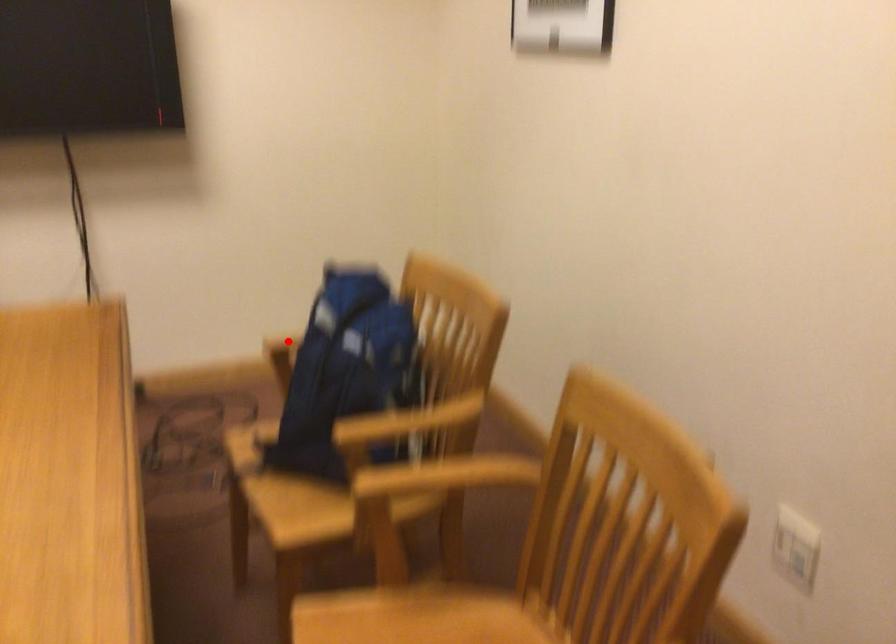
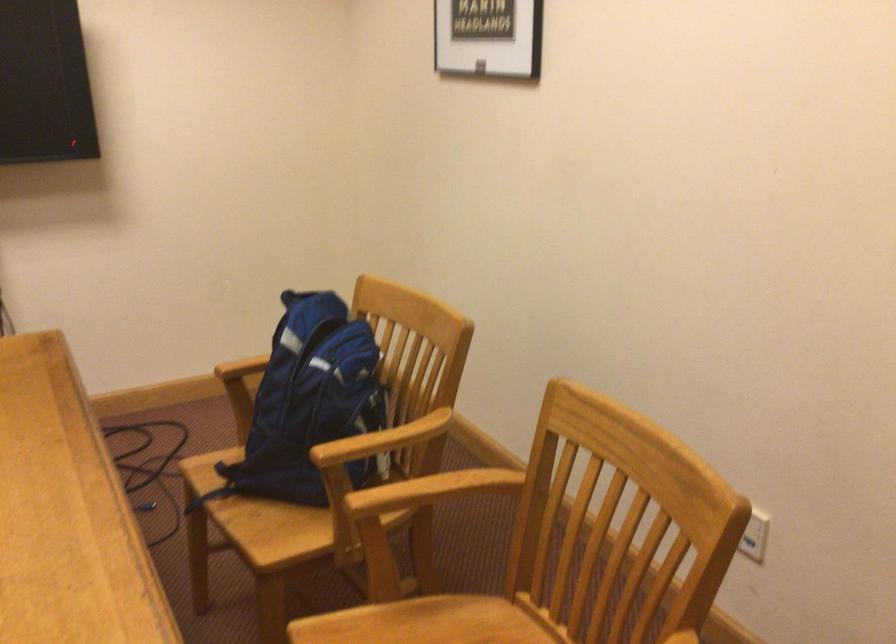
Find the pixel in the second image that matches the highlighted location in the first image.

(242, 368)